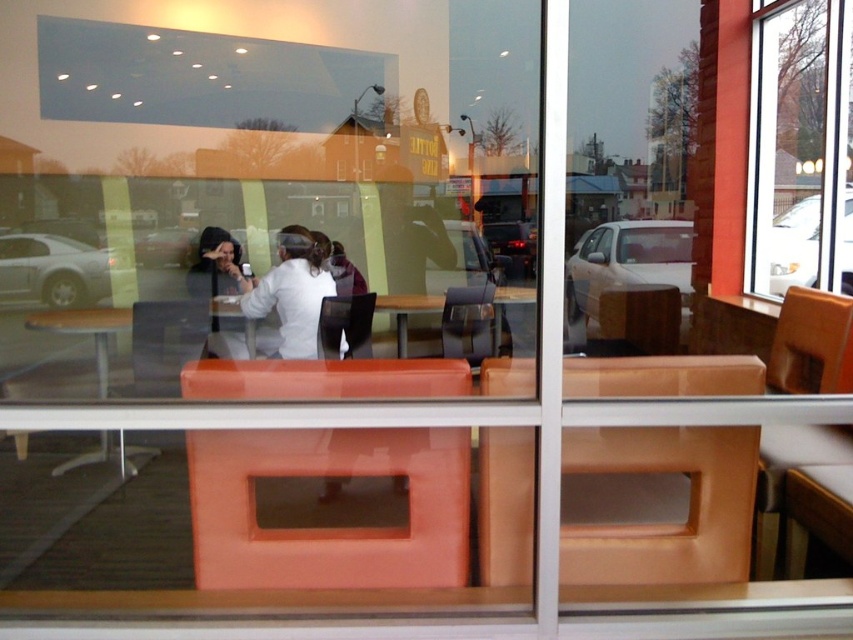
Question: Considering the relative positions of transparent glass window at upper right and white matte shirt at center in the image provided, where is transparent glass window at upper right located with respect to white matte shirt at center?

Choices:
 (A) above
 (B) below

Answer: (A)

Question: Which point is farther to the camera?

Choices:
 (A) (310, 262)
 (B) (786, 77)

Answer: (B)

Question: Which point appears closest to the camera in this image?

Choices:
 (A) (299, 234)
 (B) (763, 246)

Answer: (A)

Question: Does transparent glass window at upper right lie in front of white matte shirt at center?

Choices:
 (A) yes
 (B) no

Answer: (B)

Question: In this image, where is transparent glass window at upper right located relative to white matte shirt at center?

Choices:
 (A) left
 (B) right

Answer: (B)